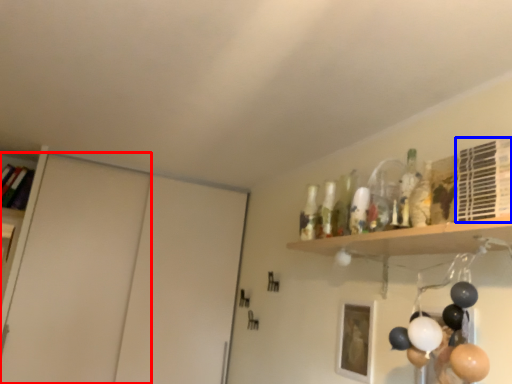
Question: Which object is closer to the camera taking this photo, door (highlighted by a red box) or shelf (highlighted by a blue box)?

Choices:
 (A) door
 (B) shelf

Answer: (B)